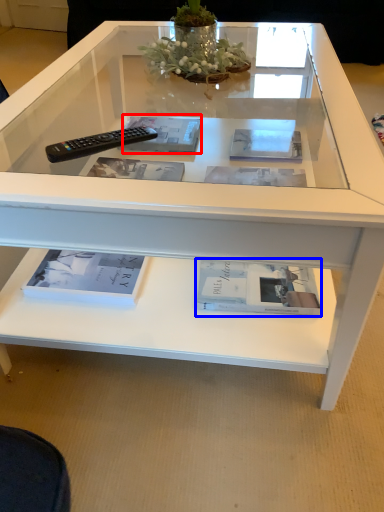
Question: Which object is further to the camera taking this photo, magazine (highlighted by a red box) or book (highlighted by a blue box)?

Choices:
 (A) magazine
 (B) book

Answer: (A)